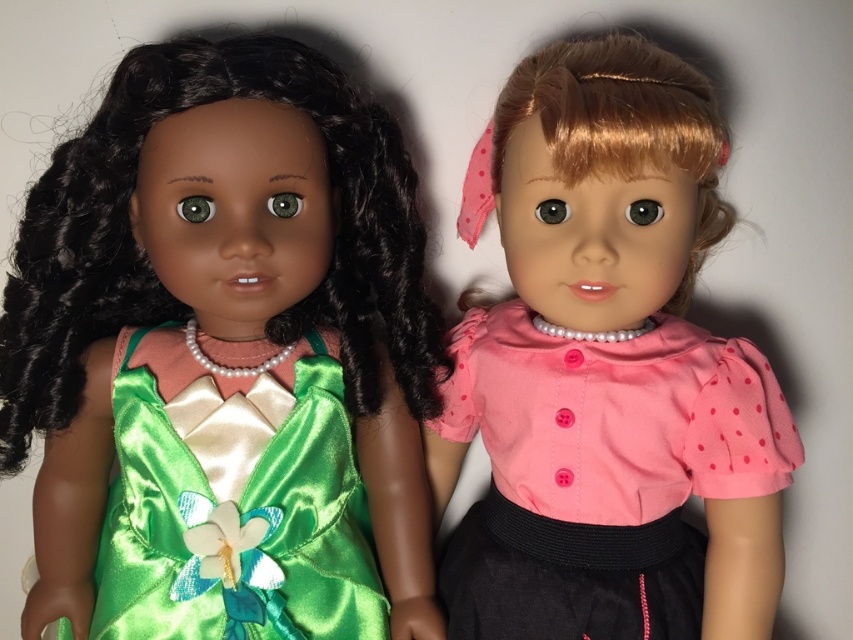
Between point (241, 433) and point (138, 602), which one is positioned behind?

The point (138, 602) is behind.

Is green satin dress at left above green satin dress at center?

Correct, green satin dress at left is located above green satin dress at center.

Where is `green satin dress at left`? The height and width of the screenshot is (640, 853). green satin dress at left is located at coordinates (224, 356).

Can you confirm if pink satin blouse at center is bigger than green satin dress at center?

Indeed, pink satin blouse at center has a larger size compared to green satin dress at center.

This screenshot has height=640, width=853. What do you see at coordinates (608, 372) in the screenshot? I see `pink satin blouse at center` at bounding box center [608, 372].

I want to click on pink satin blouse at center, so click(608, 372).

At what (x,y) coordinates should I click in order to perform the action: click on pink satin blouse at center. Please return your answer as a coordinate pair (x, y). Looking at the image, I should click on (608, 372).

Can you confirm if green satin dress at left is wider than pink satin blouse at center?

Yes.

Is point (193, 609) more distant than point (730, 216)?

No, it is not.

This screenshot has width=853, height=640. What are the coordinates of `green satin dress at left` in the screenshot? It's located at (224, 356).